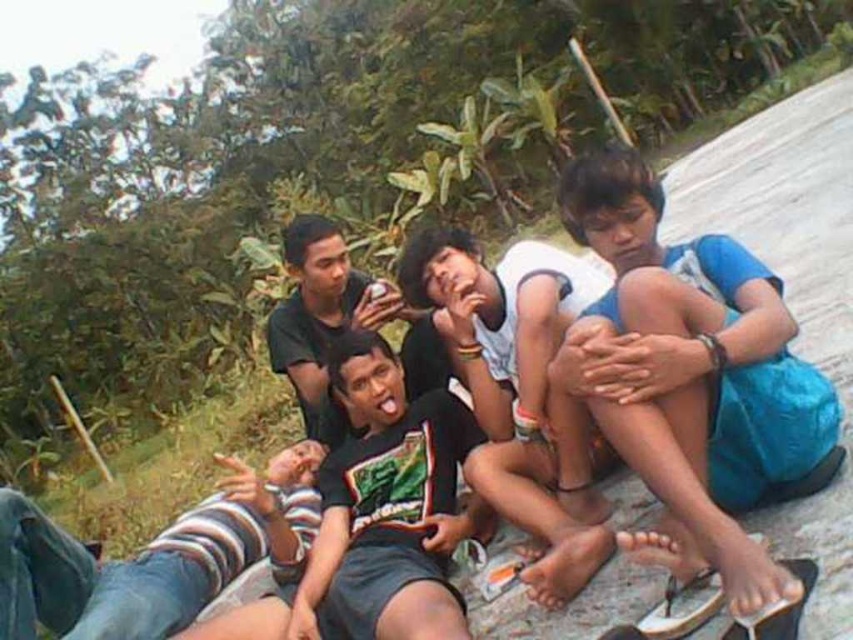
Who is taller, black matte shirt at center or white rubber sandal at lower right?

black matte shirt at center

Is black matte shirt at center positioned before white rubber sandal at lower right?

That is False.

Measure the distance between point (297, 369) and camera.

They are 3.75 meters apart.

Locate an element on the screen. black matte shirt at center is located at coordinates (318, 310).